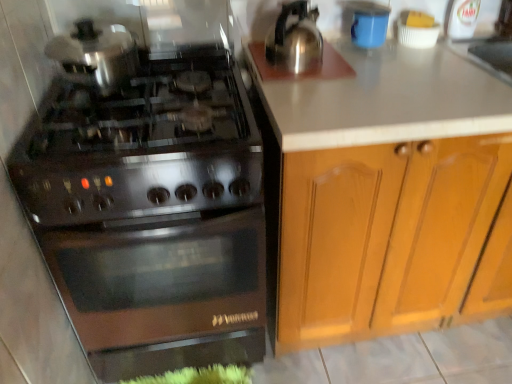
What are the coordinates of `vacant area that is in front of blue matte cup at upper right` in the screenshot? It's located at [355, 68].